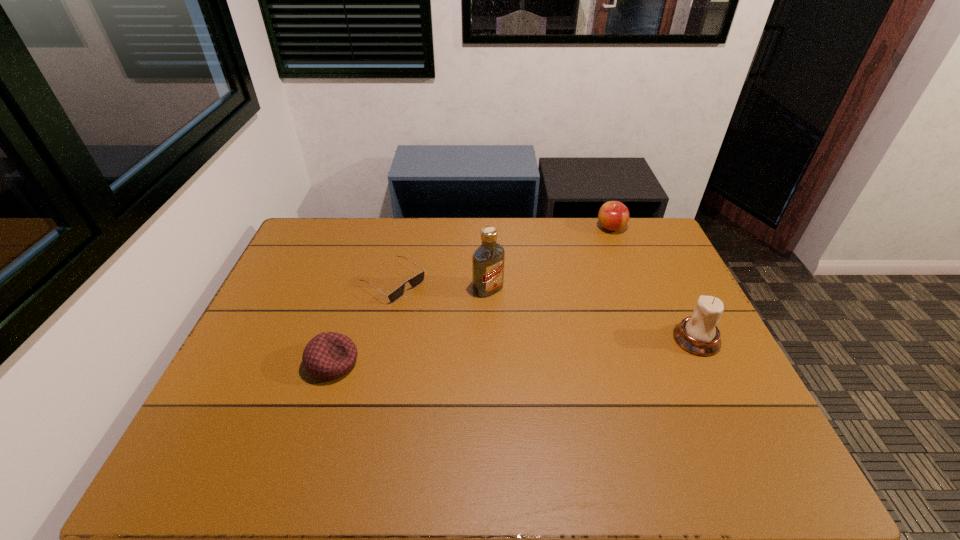
The height and width of the screenshot is (540, 960). I want to click on apple located at the right edge, so point(613,215).

Identify the location of object present at the far right corner. The image size is (960, 540). (613, 215).

In the image, there is a desktop. Identify the location of vacant area at the far edge. This screenshot has height=540, width=960. pos(504,221).

I want to click on vacant space at the near edge of the desktop, so click(x=573, y=429).

This screenshot has width=960, height=540. In the image, there is a desktop. Identify the location of vacant space at the left edge. (258, 315).

The width and height of the screenshot is (960, 540). Find the location of `free space at the right edge`. free space at the right edge is located at coordinates (662, 272).

Find the location of a particular element. This screenshot has width=960, height=540. free spot at the far left corner of the desktop is located at coordinates (340, 229).

This screenshot has height=540, width=960. I want to click on free point at the far right corner, so click(655, 255).

Image resolution: width=960 pixels, height=540 pixels. Find the location of `blank region between the vodka and the apple`. blank region between the vodka and the apple is located at coordinates (549, 258).

Where is `vacant point located between the fourth shortest object and the sunglasses`? vacant point located between the fourth shortest object and the sunglasses is located at coordinates (544, 310).